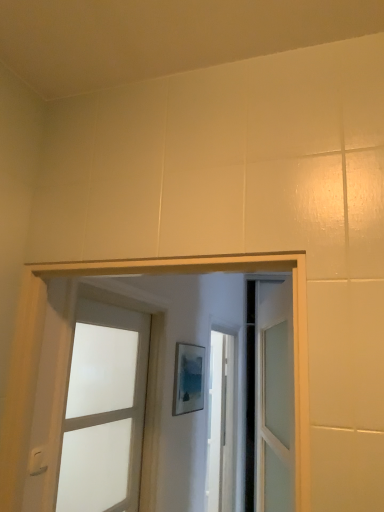
What do you see at coordinates (104, 410) in the screenshot? I see `white frosted glass door at center` at bounding box center [104, 410].

Where is `white frosted glass door at center`? This screenshot has width=384, height=512. white frosted glass door at center is located at coordinates (104, 410).

Describe the element at coordinates (37, 462) in the screenshot. I see `white plastic light switch at lower left` at that location.

What is the approximate width of white plastic light switch at lower left?

white plastic light switch at lower left is 0.91 inches wide.

Where is `white plastic light switch at lower left`? white plastic light switch at lower left is located at coordinates (37, 462).

Find the location of a particular element. Image resolution: width=384 pixels, height=512 pixels. white frosted glass door at center is located at coordinates (104, 410).

In the image, is white frosted glass door at center on the left side or the right side of white plastic light switch at lower left?

white frosted glass door at center is to the right of white plastic light switch at lower left.

Is white frosted glass door at center in front of or behind white plastic light switch at lower left in the image?

Clearly, white frosted glass door at center is behind white plastic light switch at lower left.

Does point (101, 311) appear closer or farther from the camera than point (40, 453)?

Point (101, 311).

From the image's perspective, between white frosted glass door at center and white plastic light switch at lower left, who is located below?

From the image's view, white frosted glass door at center is below.

From a real-world perspective, which object stands above the other?

white frosted glass door at center is physically above.

Between white frosted glass door at center and white plastic light switch at lower left, which one has smaller width?

white plastic light switch at lower left.

Considering the sizes of objects white frosted glass door at center and white plastic light switch at lower left in the image provided, who is taller, white frosted glass door at center or white plastic light switch at lower left?

white frosted glass door at center.

Looking at this image, which of these two, white frosted glass door at center or white plastic light switch at lower left, is smaller?

white plastic light switch at lower left is smaller.

Is white frosted glass door at center not within white plastic light switch at lower left?

Yes.

From the picture: Is white frosted glass door at center touching white plastic light switch at lower left?

No, white frosted glass door at center is not touching white plastic light switch at lower left.

Is white plastic light switch at lower left at the back of white frosted glass door at center?

No, white plastic light switch at lower left is not at the back of white frosted glass door at center.

What's the angular difference between white frosted glass door at center and white plastic light switch at lower left's facing directions?

white frosted glass door at center and white plastic light switch at lower left are facing 0.000311 degrees away from each other.

Where is `light switch below the white frosted glass door at center (from a real-world perspective)`? This screenshot has height=512, width=384. light switch below the white frosted glass door at center (from a real-world perspective) is located at coordinates (37, 462).

Based on their positions, is white plastic light switch at lower left located to the left or right of white frosted glass door at center?

white plastic light switch at lower left is to the left of white frosted glass door at center.

Which object is more forward, white plastic light switch at lower left or white frosted glass door at center?

white plastic light switch at lower left is in front.

Which is farther, [33,463] or [87,358]?

The point [87,358] is farther.

From the image's perspective, which is below, white plastic light switch at lower left or white frosted glass door at center?

white frosted glass door at center is shown below in the image.

From a real-world perspective, is white plastic light switch at lower left physically below white frosted glass door at center?

Indeed, from a real-world perspective, white plastic light switch at lower left is positioned beneath white frosted glass door at center.

Is white plastic light switch at lower left thinner than white frosted glass door at center?

Yes.

Who is shorter, white plastic light switch at lower left or white frosted glass door at center?

Standing shorter between the two is white plastic light switch at lower left.

Considering the sizes of objects white plastic light switch at lower left and white frosted glass door at center in the image provided, who is bigger, white plastic light switch at lower left or white frosted glass door at center?

white frosted glass door at center.

Is white plastic light switch at lower left positioned beyond the bounds of white frosted glass door at center?

→ Yes, white plastic light switch at lower left is located beyond the bounds of white frosted glass door at center.

Is white plastic light switch at lower left far away from white frosted glass door at center?

They are positioned close to each other.

Is white plastic light switch at lower left positioned with its back to white frosted glass door at center?

That's not correct — white plastic light switch at lower left is not looking away from white frosted glass door at center.

How different are the orientations of white plastic light switch at lower left and white frosted glass door at center in degrees?

The facing directions of white plastic light switch at lower left and white frosted glass door at center are 0.000311 degrees apart.

How distant is white plastic light switch at lower left from white frosted glass door at center?

The distance of white plastic light switch at lower left from white frosted glass door at center is 24.59 inches.

The image size is (384, 512). I want to click on light switch above the white frosted glass door at center (from the image's perspective), so click(37, 462).

The image size is (384, 512). I want to click on light switch lying above the white frosted glass door at center (from the image's perspective), so click(x=37, y=462).

The image size is (384, 512). What are the coordinates of `door above the white plastic light switch at lower left (from a real-world perspective)` in the screenshot? It's located at (104, 410).